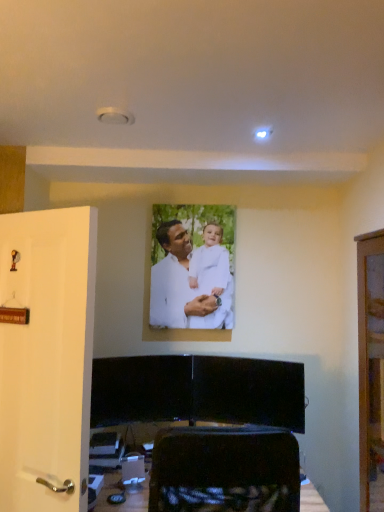
Question: Is white matte door at left located within white matte portrait at center?

Choices:
 (A) no
 (B) yes

Answer: (A)

Question: Is the depth of white matte portrait at center less than that of white matte door at left?

Choices:
 (A) no
 (B) yes

Answer: (A)

Question: Considering the relative sizes of white matte portrait at center and white matte door at left in the image provided, is white matte portrait at center bigger than white matte door at left?

Choices:
 (A) no
 (B) yes

Answer: (A)

Question: Would you consider white matte portrait at center to be distant from white matte door at left?

Choices:
 (A) no
 (B) yes

Answer: (B)

Question: Can you confirm if white matte portrait at center is thinner than white matte door at left?

Choices:
 (A) yes
 (B) no

Answer: (A)

Question: From the image's perspective, is white matte portrait at center located beneath white matte door at left?

Choices:
 (A) yes
 (B) no

Answer: (B)

Question: From a real-world perspective, is white matte door at left physically above white matte portrait at center?

Choices:
 (A) no
 (B) yes

Answer: (A)

Question: Can you confirm if white matte door at left is taller than white matte portrait at center?

Choices:
 (A) yes
 (B) no

Answer: (A)

Question: Can white matte portrait at center be found inside white matte door at left?

Choices:
 (A) no
 (B) yes

Answer: (A)

Question: Is white matte door at left next to white matte portrait at center and touching it?

Choices:
 (A) yes
 (B) no

Answer: (B)

Question: Does white matte door at left have a smaller size compared to white matte portrait at center?

Choices:
 (A) yes
 (B) no

Answer: (B)

Question: Does white matte door at left lie in front of white matte portrait at center?

Choices:
 (A) yes
 (B) no

Answer: (A)

Question: Considering their positions, is white matte door at left located in front of or behind white matte portrait at center?

Choices:
 (A) front
 (B) behind

Answer: (A)